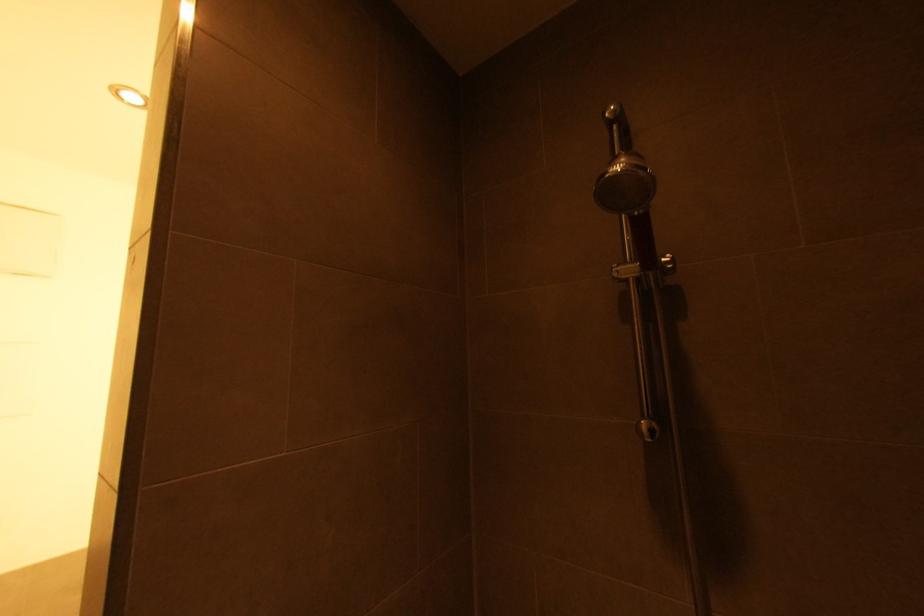
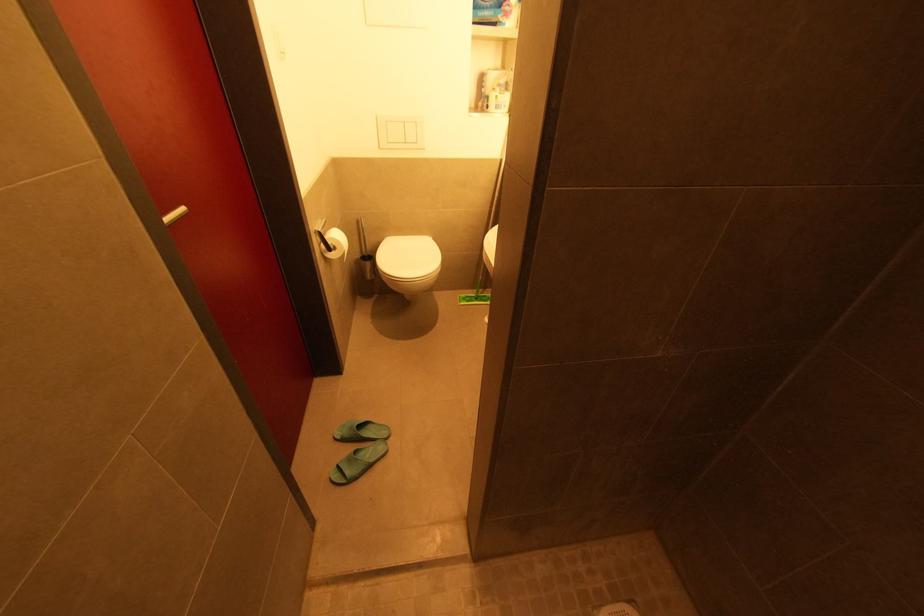
The first image is from the beginning of the video and the second image is from the end. How did the camera likely rotate when shooting the video?

The camera rotated toward left-down.